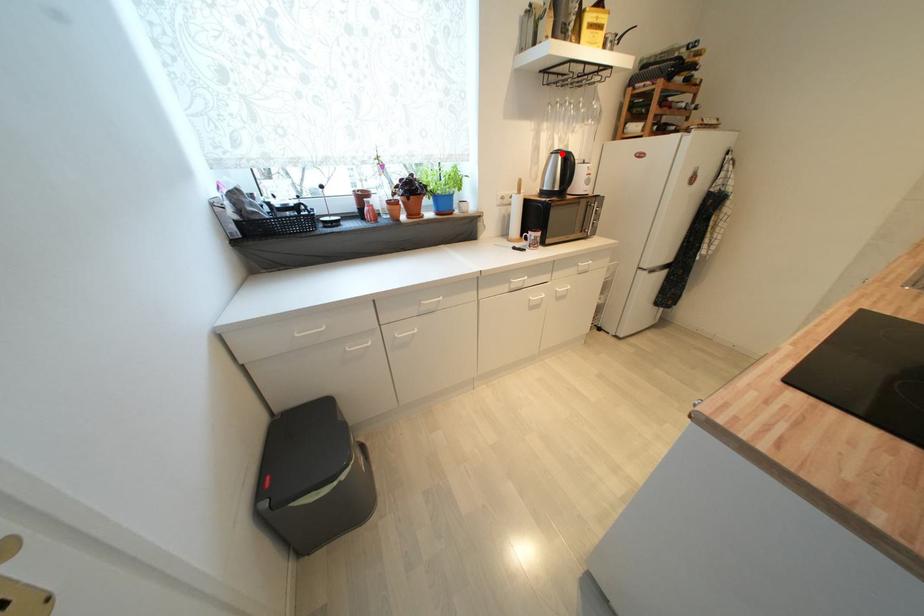
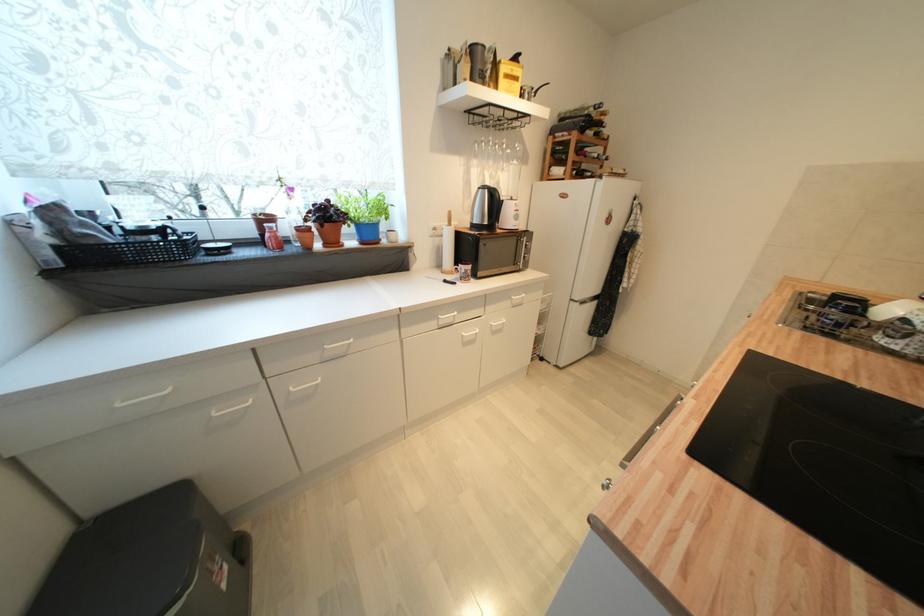
In the second image, find the point that corresponds to the highlighted location in the first image.

(489, 188)